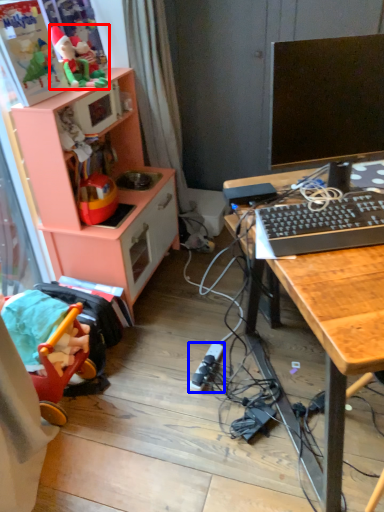
Question: Which object appears farthest to the camera in this image, toy (highlighted by a red box) or plug (highlighted by a blue box)?

Choices:
 (A) toy
 (B) plug

Answer: (A)